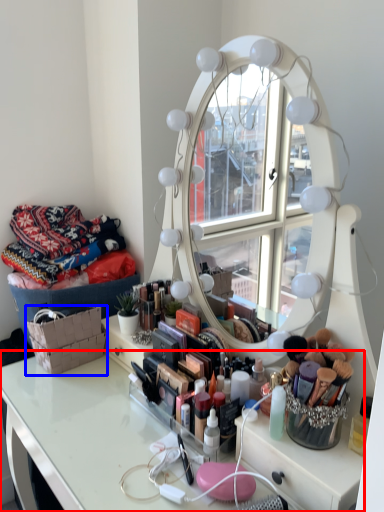
Question: Which object appears closest to the camera in this image, table (highlighted by a red box) or basket (highlighted by a blue box)?

Choices:
 (A) table
 (B) basket

Answer: (A)